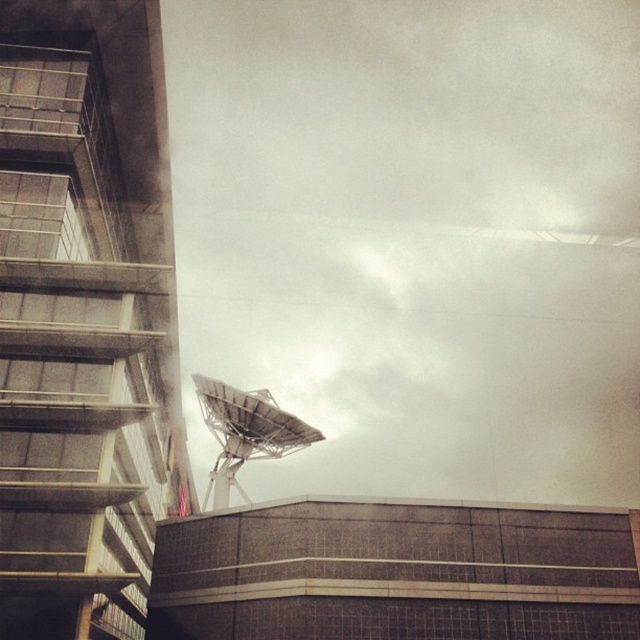
Does point (417, 262) lie behind point (272, 449)?

Yes.

Does white matte satellite dish at center have a smaller size compared to metallic satellite dish at lower center?

No, white matte satellite dish at center is not smaller than metallic satellite dish at lower center.

Is point (192, 228) in front of point (211, 484)?

No, (192, 228) is behind (211, 484).

Find the location of a particular element. The width and height of the screenshot is (640, 640). white matte satellite dish at center is located at coordinates (413, 237).